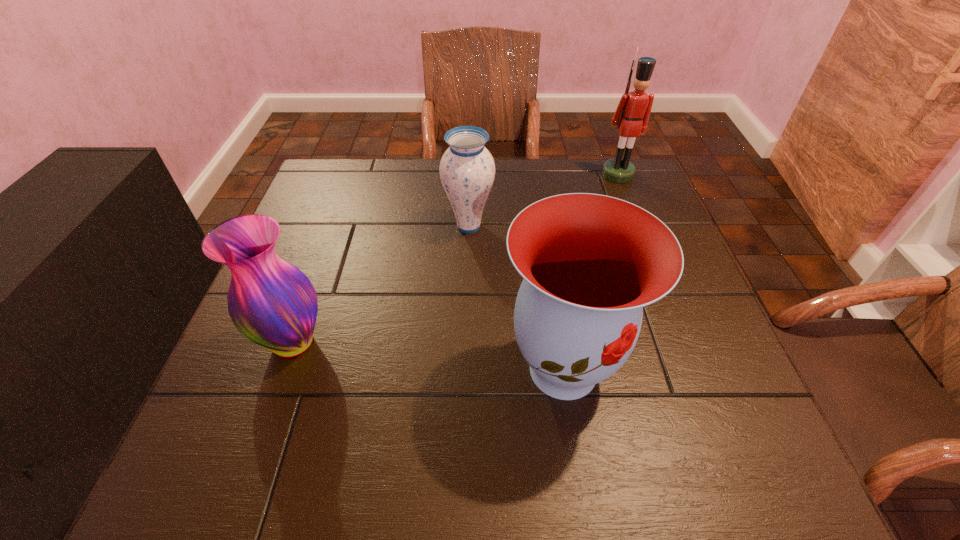
The image size is (960, 540). Find the location of `the farthest object`. the farthest object is located at coordinates (632, 114).

At what (x,y) coordinates should I click in order to perform the action: click on nutcracker. Please return your answer as a coordinate pair (x, y). The width and height of the screenshot is (960, 540). Looking at the image, I should click on (632, 114).

Locate an element on the screen. the third object from left to right is located at coordinates (589, 262).

You are a GUI agent. You are given a task and a screenshot of the screen. Output one action in this format:
    pyautogui.click(x=<x>, y=<y>)
    Task: Click on the leftmost vase
    The image size is (960, 540).
    Given the screenshot: What is the action you would take?
    pyautogui.click(x=271, y=302)

Identify the location of the farthest vase. (467, 169).

Where is `the second object from left to right`? the second object from left to right is located at coordinates (467, 169).

Where is `free space located 0.270m on the front-facing side of the farthest object`? free space located 0.270m on the front-facing side of the farthest object is located at coordinates (646, 247).

Image resolution: width=960 pixels, height=540 pixels. I want to click on vacant space located 0.340m on the back of the rightmost vase, so tap(540, 217).

Where is `free spot located on the back of the leftmost vase`? free spot located on the back of the leftmost vase is located at coordinates (322, 264).

You are a GUI agent. You are given a task and a screenshot of the screen. Output one action in this format:
    pyautogui.click(x=<x>, y=<y>)
    Task: Click on the free spot located on the right of the second farthest object
    The image size is (960, 540).
    Given the screenshot: What is the action you would take?
    pyautogui.click(x=636, y=226)